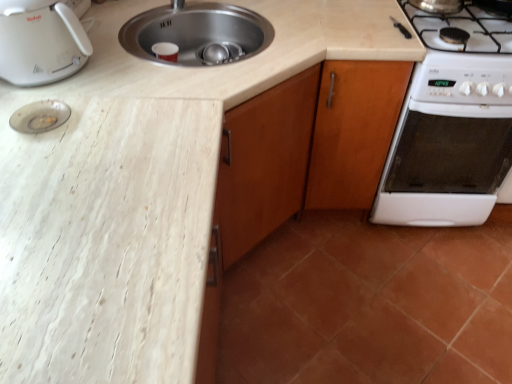
Find the location of a particular element. This screenshot has width=512, height=384. white glossy oven at right is located at coordinates (449, 143).

You are a GUI agent. You are given a task and a screenshot of the screen. Output one action in this format:
    pyautogui.click(x=<x>, y=<y>)
    Task: Click on the transparent glass plate at upper left
    Image resolution: width=512 pixels, height=384 pixels.
    Given the screenshot: What is the action you would take?
    pyautogui.click(x=40, y=116)

What do you see at coordinates (40, 116) in the screenshot? I see `transparent glass plate at upper left` at bounding box center [40, 116].

Describe the element at coordinates (353, 131) in the screenshot. I see `wooden cabinet at right` at that location.

Locate an element on the screen. wooden cabinet at right is located at coordinates (353, 131).

This screenshot has width=512, height=384. Describe the element at coordinates (370, 304) in the screenshot. I see `terracotta tile at lower right` at that location.

Locate an element on the screen. white glossy oven at right is located at coordinates (449, 143).

Relative to white plastic toaster at upper left, is white marble countertop at left in front or behind?

In the image, white marble countertop at left appears in front of white plastic toaster at upper left.

Would you say white marble countertop at left is inside or outside white plastic toaster at upper left?

white marble countertop at left exists outside the volume of white plastic toaster at upper left.

Measure the distance between white marble countertop at left and white plastic toaster at upper left.

white marble countertop at left is 15.63 inches away from white plastic toaster at upper left.

In order to click on counter top lying in front of the white plastic toaster at upper left in this screenshot , I will do `click(106, 240)`.

Looking at the image, does wooden cabinet at right seem bigger or smaller compared to white plastic toaster at upper left?

Considering their sizes, wooden cabinet at right takes up more space than white plastic toaster at upper left.

Does wooden cabinet at right have a greater height compared to white plastic toaster at upper left?

Yes.

Which is behind, point (352, 167) or point (39, 68)?

The point (352, 167) is farther from the camera.

Can you tell me how much wooden cabinet at right and white plastic toaster at upper left differ in facing direction?

90 degrees separate the facing orientations of wooden cabinet at right and white plastic toaster at upper left.

In the scene shown: From the image's perspective, which object appears higher, terracotta tile at lower right or transparent glass plate at upper left?

transparent glass plate at upper left.

Does point (251, 377) come closer to viewer compared to point (46, 118)?

No, it is not.

Does terracotta tile at lower right lie behind transparent glass plate at upper left?

Yes, the depth of terracotta tile at lower right is greater than that of transparent glass plate at upper left.

Considering the relative sizes of terracotta tile at lower right and transparent glass plate at upper left in the image provided, is terracotta tile at lower right taller than transparent glass plate at upper left?

Yes, terracotta tile at lower right is taller than transparent glass plate at upper left.

From a real-world perspective, is white marble countertop at left located beneath terracotta tile at lower right?

No, from a real-world perspective, white marble countertop at left is not beneath terracotta tile at lower right.

Measure the distance between white marble countertop at left and terracotta tile at lower right.

white marble countertop at left and terracotta tile at lower right are 38.17 inches apart from each other.

Relative to terracotta tile at lower right, is white marble countertop at left in front or behind?

white marble countertop at left is in front of terracotta tile at lower right.

From the image's perspective, is white marble countertop at left positioned above or below terracotta tile at lower right?

From the image's perspective, white marble countertop at left appears above terracotta tile at lower right.

Considering their positions, is white marble countertop at left located in front of or behind wooden cabinet at right?

In the image, white marble countertop at left appears in front of wooden cabinet at right.

Can you confirm if white marble countertop at left is bigger than wooden cabinet at right?

Correct, white marble countertop at left is larger in size than wooden cabinet at right.

From the image's perspective, relative to wooden cabinet at right, is white marble countertop at left above or below?

From the image's perspective, white marble countertop at left appears below wooden cabinet at right.

Is white marble countertop at left positioned far away from wooden cabinet at right?

white marble countertop at left is actually quite close to wooden cabinet at right.

From the image's perspective, which object appears higher, transparent glass plate at upper left or white marble countertop at left?

transparent glass plate at upper left is shown above in the image.

Find the location of a particular element. Image resolution: width=512 pixels, height=384 pixels. counter top located underneath the transparent glass plate at upper left (from a real-world perspective) is located at coordinates (106, 240).

Which of these two, transparent glass plate at upper left or white marble countertop at left, is thinner?

transparent glass plate at upper left.

Between transparent glass plate at upper left and white marble countertop at left, which one has less height?

transparent glass plate at upper left is shorter.

Is terracotta tile at lower right oriented away from white glossy oven at right?

No, white glossy oven at right is not at the back of terracotta tile at lower right.

Based on the photo, which is closer to the camera, (292, 239) or (443, 108)?

Point (292, 239) appears to be farther away from the viewer than point (443, 108).

Between terracotta tile at lower right and white glossy oven at right, which one has larger size?

white glossy oven at right.

Would you say terracotta tile at lower right is to the left or to the right of white glossy oven at right in the picture?

From the image, it's evident that terracotta tile at lower right is to the left of white glossy oven at right.

Find the location of `counter top that appears below the white plastic toaster at upper left (from a real-world perspective)`. counter top that appears below the white plastic toaster at upper left (from a real-world perspective) is located at coordinates (106, 240).

This screenshot has width=512, height=384. Find the location of `cabinetry on the right of white plastic toaster at upper left`. cabinetry on the right of white plastic toaster at upper left is located at coordinates (353, 131).

From the image, which object appears to be farther from white glossy oven at right, transparent glass plate at upper left or wooden cabinet at right?

transparent glass plate at upper left is positioned further to the anchor white glossy oven at right.

Looking at the image, which one is located closer to white marble countertop at left, terracotta tile at lower right or wooden cabinet at right?

The object closer to white marble countertop at left is wooden cabinet at right.

When comparing their distances from white plastic toaster at upper left, does white marble countertop at left or terracotta tile at lower right seem further?

terracotta tile at lower right is further to white plastic toaster at upper left.

From the picture: Which object lies further to the anchor point transparent glass plate at upper left, white plastic toaster at upper left or white marble countertop at left?

Based on the image, white marble countertop at left appears to be further to transparent glass plate at upper left.

Which object lies further to the anchor point terracotta tile at lower right, white plastic toaster at upper left or white marble countertop at left?

white plastic toaster at upper left.

Estimate the real-world distances between objects in this image. Which object is closer to transparent glass plate at upper left, white glossy oven at right or terracotta tile at lower right?

terracotta tile at lower right.

When comparing their distances from white plastic toaster at upper left, does transparent glass plate at upper left or terracotta tile at lower right seem further?

terracotta tile at lower right.

Which object lies nearer to the anchor point wooden cabinet at right, terracotta tile at lower right or white plastic toaster at upper left?

terracotta tile at lower right is closer to wooden cabinet at right.

Image resolution: width=512 pixels, height=384 pixels. Identify the location of cabinetry between white marble countertop at left and white glossy oven at right from left to right. (353, 131).

You are a GUI agent. You are given a task and a screenshot of the screen. Output one action in this format:
    pyautogui.click(x=<x>, y=<y>)
    Task: Click on the counter top situated between transparent glass plate at upper left and white glossy oven at right from left to right
    The image size is (512, 384).
    Given the screenshot: What is the action you would take?
    point(106,240)

Where is `cabinetry between transparent glass plate at upper left and terracotta tile at lower right from left to right`? This screenshot has width=512, height=384. cabinetry between transparent glass plate at upper left and terracotta tile at lower right from left to right is located at coordinates (353, 131).

Locate an element on the screen. This screenshot has width=512, height=384. cabinetry between white plastic toaster at upper left and white glossy oven at right in the horizontal direction is located at coordinates (353, 131).